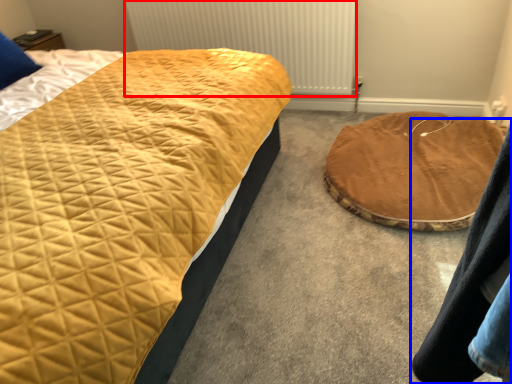
Question: Which object is closer to the camera taking this photo, radiator (highlighted by a red box) or couple (highlighted by a blue box)?

Choices:
 (A) radiator
 (B) couple

Answer: (B)